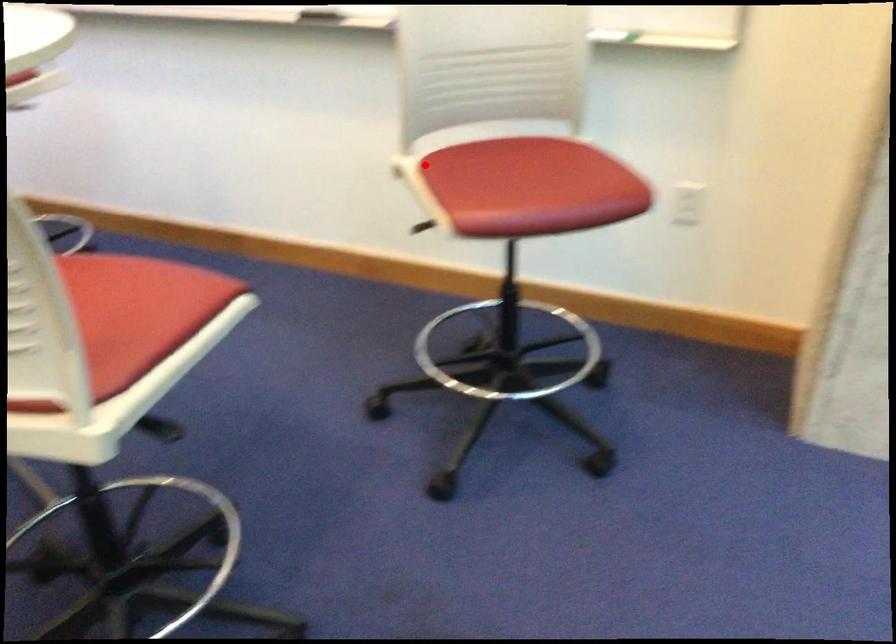
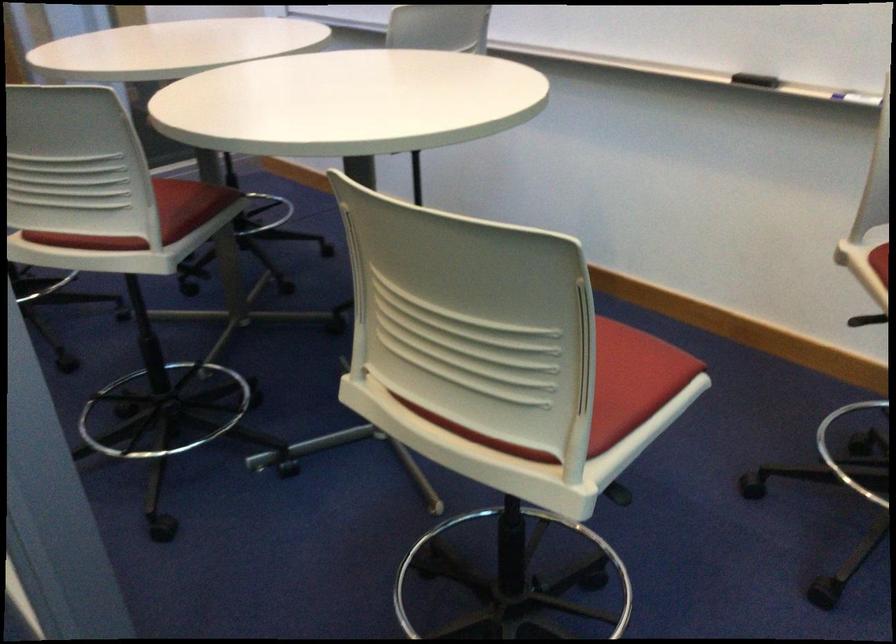
The point at the highlighted location is marked in the first image. Where is the corresponding point in the second image?

(880, 261)